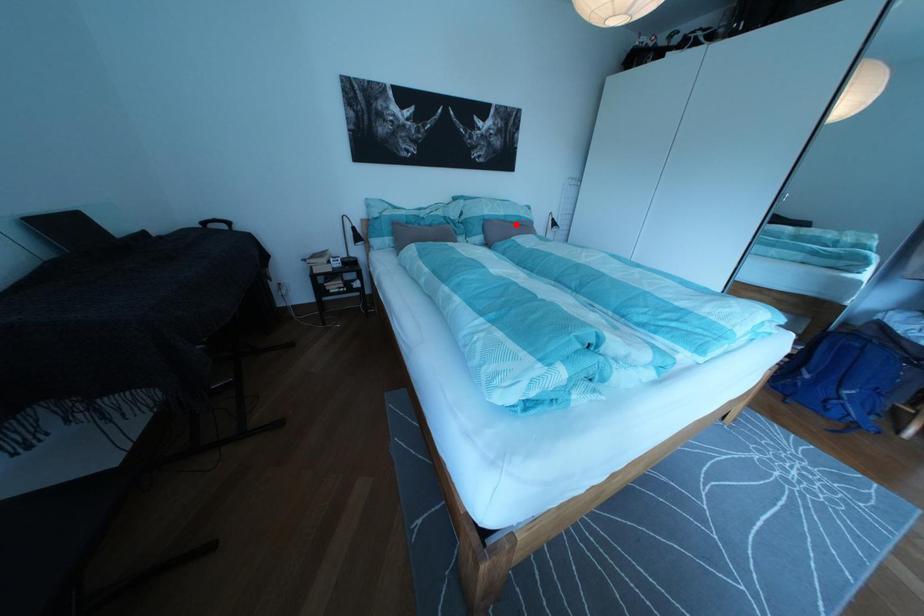
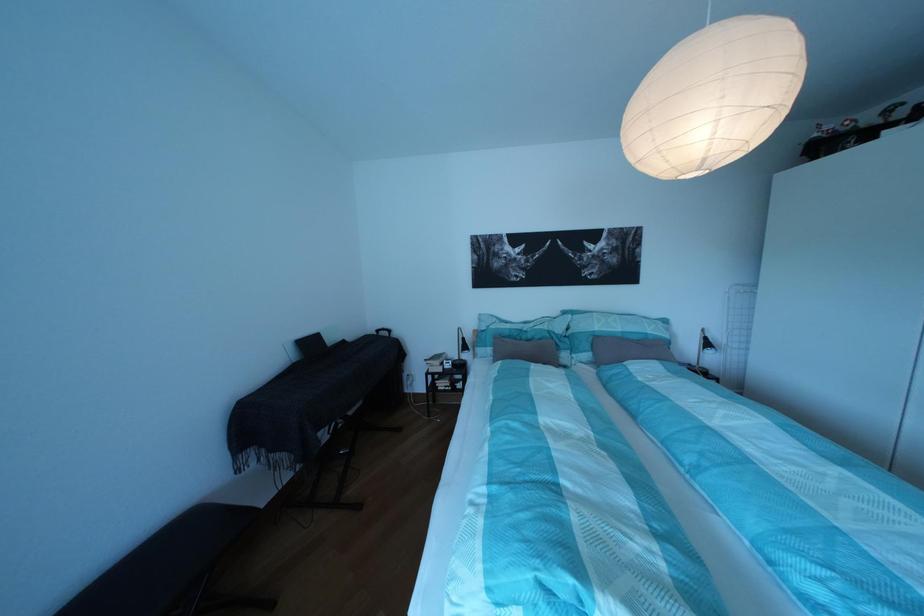
Question: A red point is marked in image1. In image2, is the corresponding 3D point closer to the camera or farther? Reply with the corresponding letter.

Choices:
 (A) The corresponding 3D point is closer.
 (B) The corresponding 3D point is farther.

Answer: (B)